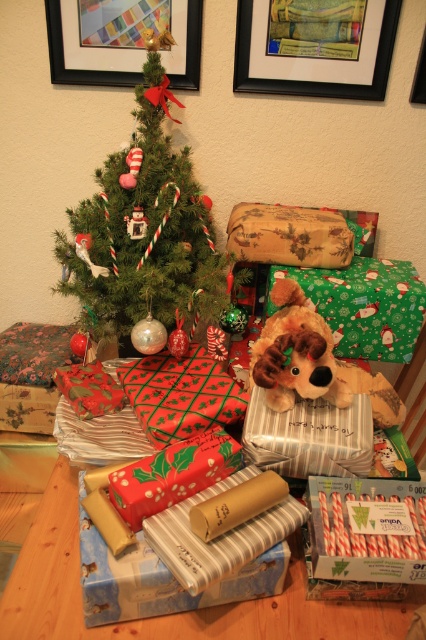
You are a child looking at the green matte christmas tree at upper center and the red striped candy canes at center. Which object is closer to you?

The green matte christmas tree at upper center is closer to you than the red striped candy canes at center.

You are hanging two picture frames on a wall that can only hold a total of 18 inches between them. You have the wooden picture frame at upper center and the black plastic picture frame at upper right. Can you hang them without exceeding the wall space limit?

The wooden picture frame at upper center is 9.07 inches away from the black plastic picture frame at upper right, so the total distance between them is 9.07 inches. Since the wall can hold up to 18 inches, there is enough space to hang them without exceeding the limit.

You are a delivery person who needs to place a new gift box that is 12 inches wide between the red striped candy canes at center and the black plastic picture frame at upper right. Is there enough space to fit the gift box between them?

The distance between the red striped candy canes at center and the black plastic picture frame at upper right is 38.65 inches. Since the gift box is only 12 inches wide, there is sufficient space to place it between them.